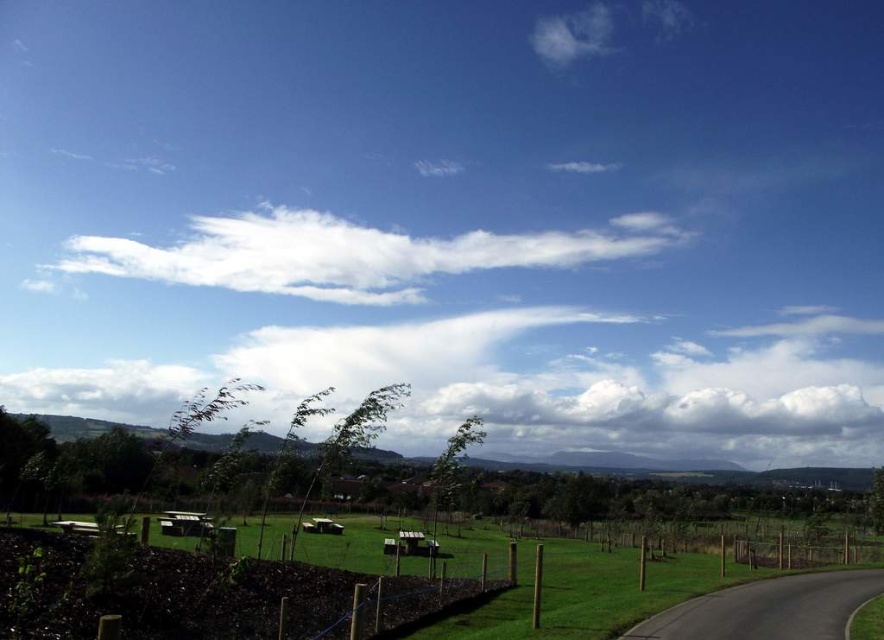
Does green grass at lower center appear on the left side of white fluffy cloud at upper center?

In fact, green grass at lower center is to the right of white fluffy cloud at upper center.

You are a GUI agent. You are given a task and a screenshot of the screen. Output one action in this format:
    pyautogui.click(x=<x>, y=<y>)
    Task: Click on the green grass at lower center
    The width and height of the screenshot is (884, 640).
    Given the screenshot: What is the action you would take?
    pyautogui.click(x=173, y=595)

Who is more forward, [226,609] or [303,250]?

Point [226,609]

The image size is (884, 640). I want to click on green grass at lower center, so click(x=173, y=595).